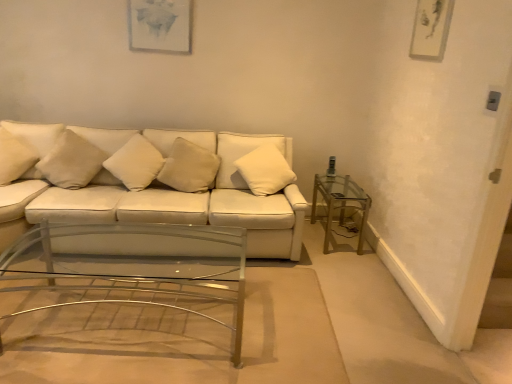
Question: From the image's perspective, is white soft pillow at center, the 1th pillow from the right, on beige fabric pillow at left, the 4th pillow in the right-to-left sequence?

Choices:
 (A) yes
 (B) no

Answer: (B)

Question: Is white soft pillow at center, which appears as the fifth pillow when viewed from the left, located outside beige fabric pillow at left, the second pillow when ordered from left to right?

Choices:
 (A) no
 (B) yes

Answer: (B)

Question: Is white soft pillow at center, which appears as the fifth pillow when viewed from the left, positioned behind beige fabric pillow at left, the 4th pillow in the right-to-left sequence?

Choices:
 (A) no
 (B) yes

Answer: (B)

Question: Is white soft pillow at center, which appears as the fifth pillow when viewed from the left, surrounding beige fabric pillow at left, the 4th pillow in the right-to-left sequence?

Choices:
 (A) yes
 (B) no

Answer: (B)

Question: From a real-world perspective, is white soft pillow at center, which appears as the fifth pillow when viewed from the left, below beige fabric pillow at left, the 4th pillow in the right-to-left sequence?

Choices:
 (A) yes
 (B) no

Answer: (B)

Question: From a real-world perspective, is white matte pillow at left, positioned as the fifth pillow in right-to-left order, above or below clear glass table at right?

Choices:
 (A) below
 (B) above

Answer: (B)

Question: From the image's perspective, is white matte pillow at left, marked as the first pillow in a left-to-right arrangement, located above or below clear glass table at right?

Choices:
 (A) below
 (B) above

Answer: (B)

Question: Is white matte pillow at left, positioned as the fifth pillow in right-to-left order, taller or shorter than clear glass table at right?

Choices:
 (A) tall
 (B) short

Answer: (B)

Question: Does point (3, 139) appear closer or farther from the camera than point (310, 210)?

Choices:
 (A) farther
 (B) closer

Answer: (B)

Question: Considering the positions of point (271, 188) and point (124, 175), is point (271, 188) closer or farther from the camera than point (124, 175)?

Choices:
 (A) closer
 (B) farther

Answer: (B)

Question: Is white soft pillow at center, the 1th pillow from the right, taller or shorter than white soft cushion at center, the third pillow positioned from the left?

Choices:
 (A) short
 (B) tall

Answer: (B)

Question: From a real-world perspective, is white soft pillow at center, which appears as the fifth pillow when viewed from the left, physically located above or below white soft cushion at center, which ranks as the 3th pillow in right-to-left order?

Choices:
 (A) below
 (B) above

Answer: (B)

Question: Considering the positions of white soft pillow at center, the 1th pillow from the right, and white soft cushion at center, which ranks as the 3th pillow in right-to-left order, in the image, is white soft pillow at center, the 1th pillow from the right, wider or thinner than white soft cushion at center, which ranks as the 3th pillow in right-to-left order,?

Choices:
 (A) thin
 (B) wide

Answer: (A)

Question: Visually, is beige fabric pillow at left, the second pillow when ordered from left to right, positioned to the left or to the right of beige fabric pillow at center, arranged as the 2th pillow when viewed from the right?

Choices:
 (A) right
 (B) left

Answer: (B)

Question: Considering the positions of point (66, 170) and point (202, 190), is point (66, 170) closer or farther from the camera than point (202, 190)?

Choices:
 (A) farther
 (B) closer

Answer: (B)